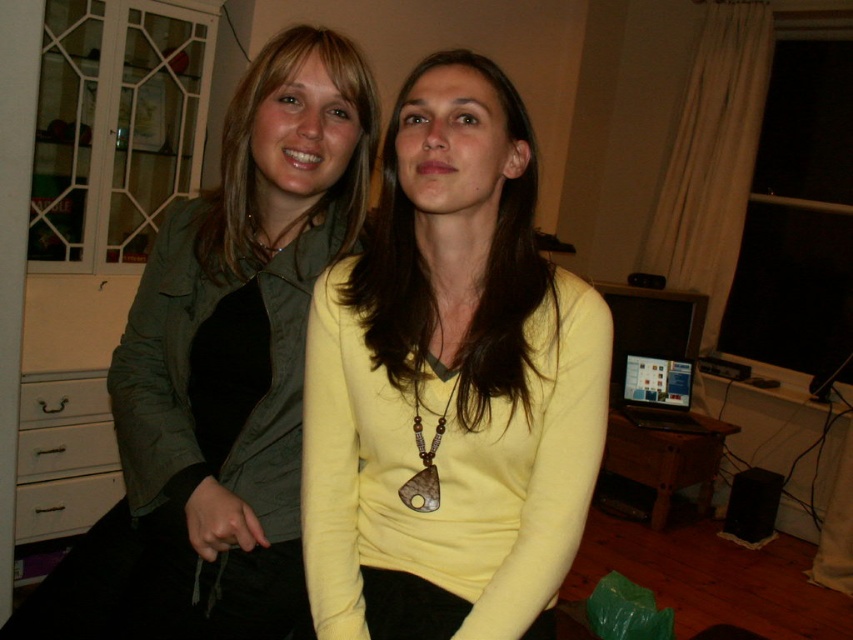
Who is higher up, yellow matte sweater at center or matte yellow sweater at center?

matte yellow sweater at center

Does yellow matte sweater at center appear on the left side of matte yellow sweater at center?

Incorrect, yellow matte sweater at center is not on the left side of matte yellow sweater at center.

Measure the distance between yellow matte sweater at center and camera.

yellow matte sweater at center and camera are 36.00 inches apart.

Locate an element on the screen. This screenshot has height=640, width=853. yellow matte sweater at center is located at coordinates (450, 385).